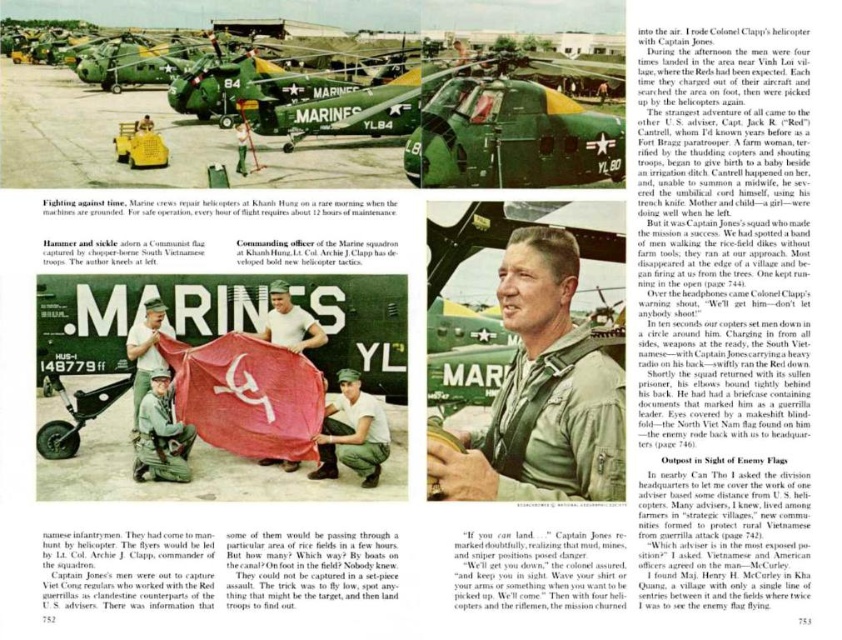
You are a military historian examining this page. You notice the green matte helicopter at center and the green camouflage uniform at center. Which object takes up more space in the image?

The green matte helicopter at center is larger in size than the green camouflage uniform at center, so it takes up more space in the image.